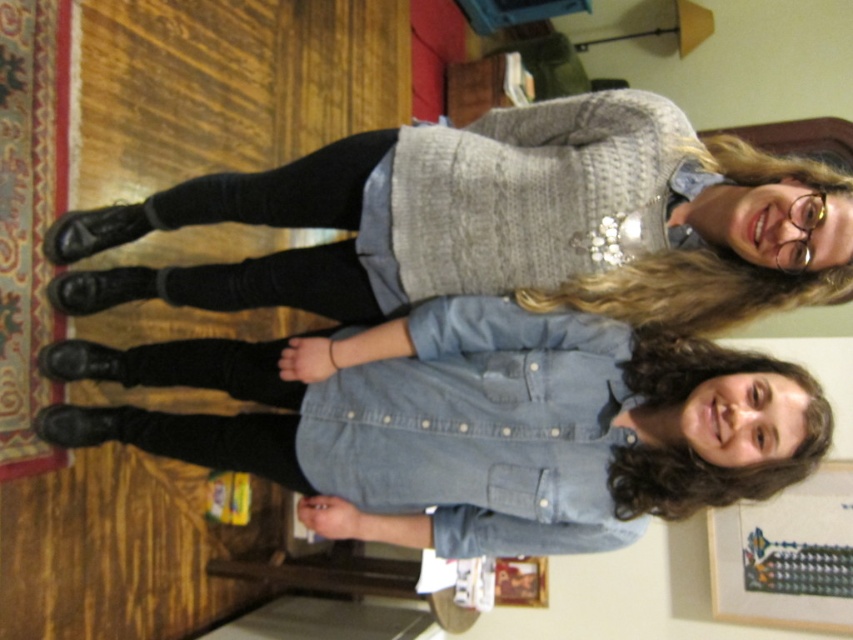
Is denim shirt at center shorter than wooden picture frame at lower right?

Correct, denim shirt at center is not as tall as wooden picture frame at lower right.

Is denim shirt at center to the right of wooden picture frame at lower right from the viewer's perspective?

Incorrect, denim shirt at center is not on the right side of wooden picture frame at lower right.

The height and width of the screenshot is (640, 853). I want to click on denim shirt at center, so click(489, 424).

Is denim shirt at center smaller than matte gray sweater at center?

Correct, denim shirt at center occupies less space than matte gray sweater at center.

Does denim shirt at center have a larger size compared to matte gray sweater at center?

No.

Does point (466, 307) come in front of point (668, 291)?

No, it is behind (668, 291).

The image size is (853, 640). In order to click on denim shirt at center in this screenshot , I will do pos(489,424).

In the scene shown: Does matte gray sweater at center appear over wooden picture frame at lower right?

Yes.

Does matte gray sweater at center appear on the right side of wooden picture frame at lower right?

Incorrect, matte gray sweater at center is not on the right side of wooden picture frame at lower right.

Identify the location of matte gray sweater at center. This screenshot has width=853, height=640. (479, 221).

The height and width of the screenshot is (640, 853). I want to click on matte gray sweater at center, so click(x=479, y=221).